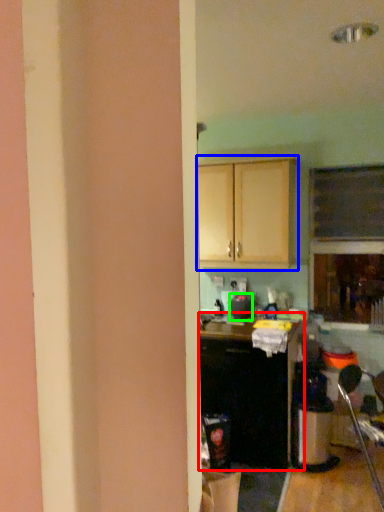
Question: Estimate the real-world distances between objects in this image. Which object is closer to cabinetry (highlighted by a red box), cabinetry (highlighted by a blue box) or appliance (highlighted by a green box)?

Choices:
 (A) cabinetry
 (B) appliance

Answer: (B)